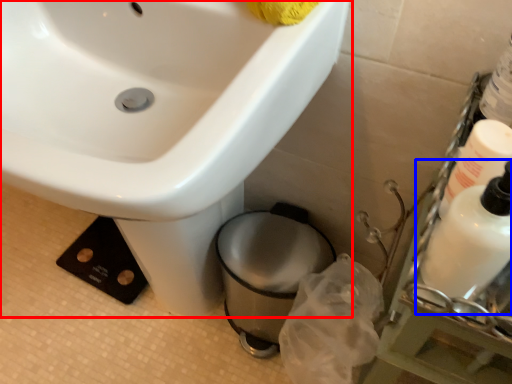
Question: Among these objects, which one is nearest to the camera, sink (highlighted by a red box) or cleaning product (highlighted by a blue box)?

Choices:
 (A) sink
 (B) cleaning product

Answer: (B)